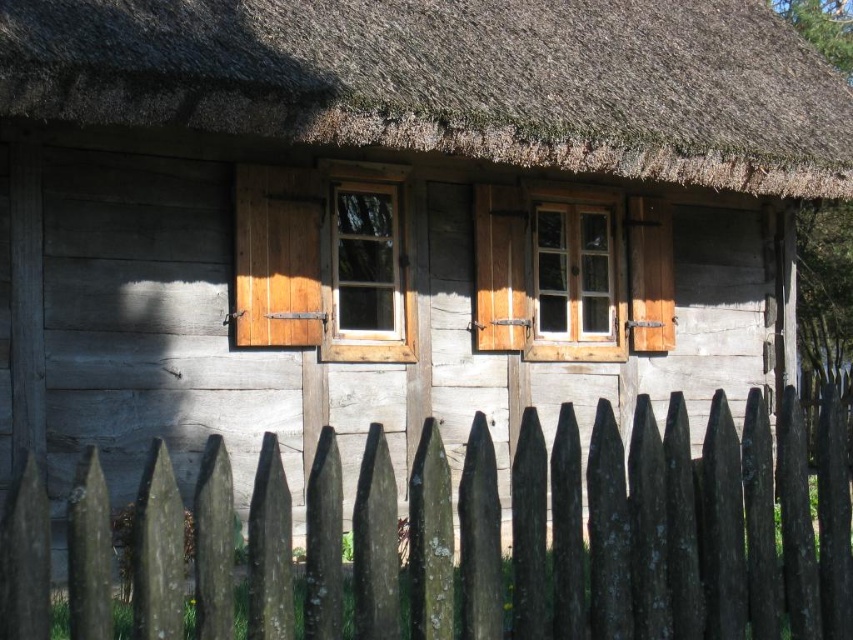
You are standing in front of the rustic wooden house with a thatched roof. There is a point marked at coordinates (x=456, y=81). What object is located at that point?

The point at coordinates (x=456, y=81) is occupied by brown thatch at upper center.

You are a painter planning to paint the brown thatch at upper center and the white wood window at center. You need to know which object is wider to estimate the amount of paint required. Can you tell me which one is wider?

The brown thatch at upper center is wider than the white wood window at center according to the description.